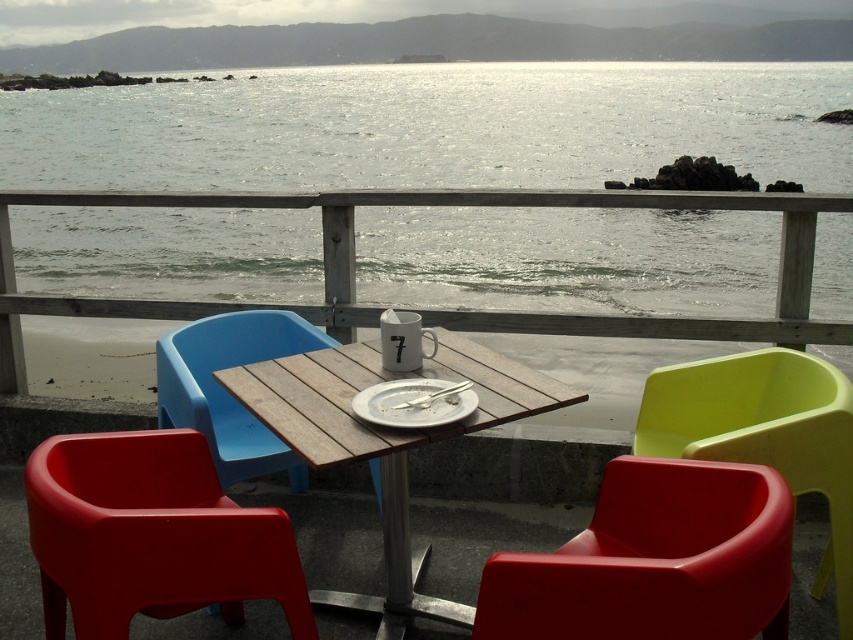
Between point (718, 225) and point (401, 381), which one is positioned in front?

Point (401, 381)

Does glistening water at table center appear on the left side of white matte plate at center?

Indeed, glistening water at table center is positioned on the left side of white matte plate at center.

Is point (773, 243) in front of point (444, 396)?

No, (773, 243) is behind (444, 396).

The height and width of the screenshot is (640, 853). I want to click on glistening water at table center, so click(433, 128).

Does lime green plastic chair at right have a greater width compared to blue plastic chair at center?

Yes.

This screenshot has height=640, width=853. Describe the element at coordinates (764, 435) in the screenshot. I see `lime green plastic chair at right` at that location.

Find the location of `lime green plastic chair at right`. lime green plastic chair at right is located at coordinates (764, 435).

Does wooden at center have a lesser height compared to wooden table at center?

No, wooden at center is not shorter than wooden table at center.

Does wooden at center appear on the right side of wooden table at center?

No, wooden at center is not to the right of wooden table at center.

Is point (16, 202) positioned after point (560, 397)?

Yes, it is.

The width and height of the screenshot is (853, 640). In order to click on wooden at center in this screenshot , I will do `click(439, 308)`.